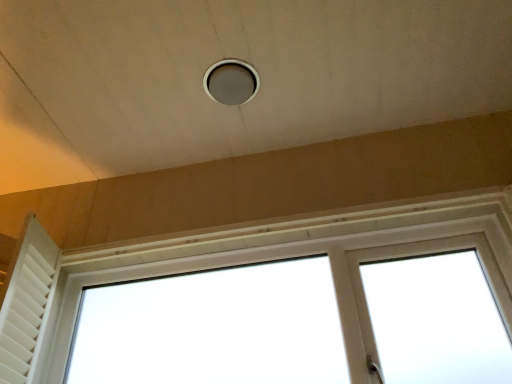
Question: Can you confirm if matte gray hole at center is shorter than white matte shutter at left?

Choices:
 (A) no
 (B) yes

Answer: (B)

Question: Is matte gray hole at center oriented towards white matte shutter at left?

Choices:
 (A) yes
 (B) no

Answer: (B)

Question: Can you confirm if matte gray hole at center is smaller than white matte shutter at left?

Choices:
 (A) no
 (B) yes

Answer: (B)

Question: Is matte gray hole at center far from white matte shutter at left?

Choices:
 (A) yes
 (B) no

Answer: (B)

Question: Is matte gray hole at center closer to the viewer compared to white matte shutter at left?

Choices:
 (A) no
 (B) yes

Answer: (A)

Question: Visually, is matte gray hole at center positioned to the left or to the right of white plastic window at center?

Choices:
 (A) right
 (B) left

Answer: (B)

Question: From their relative heights in the image, would you say matte gray hole at center is taller or shorter than white plastic window at center?

Choices:
 (A) short
 (B) tall

Answer: (A)

Question: Is point (224, 104) positioned closer to the camera than point (428, 225)?

Choices:
 (A) farther
 (B) closer

Answer: (B)

Question: In the image, is matte gray hole at center positioned in front of or behind white plastic window at center?

Choices:
 (A) behind
 (B) front

Answer: (A)

Question: Is white plastic window at center wider or thinner than matte gray hole at center?

Choices:
 (A) thin
 (B) wide

Answer: (B)

Question: In terms of size, does white plastic window at center appear bigger or smaller than matte gray hole at center?

Choices:
 (A) small
 (B) big

Answer: (B)

Question: From a real-world perspective, relative to matte gray hole at center, is white plastic window at center vertically above or below?

Choices:
 (A) above
 (B) below

Answer: (B)

Question: From the image's perspective, is white plastic window at center located above or below matte gray hole at center?

Choices:
 (A) below
 (B) above

Answer: (A)

Question: Is matte gray hole at center wider or thinner than white matte shutter at left?

Choices:
 (A) thin
 (B) wide

Answer: (A)

Question: From a real-world perspective, is matte gray hole at center positioned above or below white matte shutter at left?

Choices:
 (A) below
 (B) above

Answer: (B)